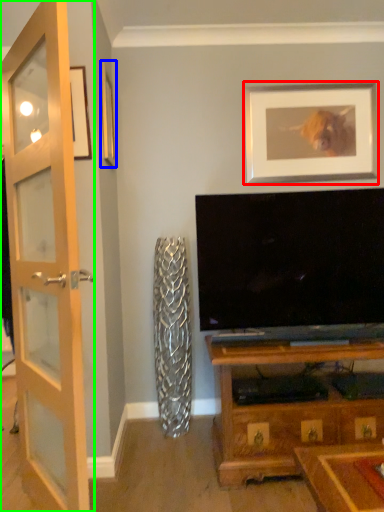
Question: Which object is positioned farthest from picture frame (highlighted by a red box)? Select from picture frame (highlighted by a blue box) and door (highlighted by a green box).

Choices:
 (A) picture frame
 (B) door

Answer: (B)